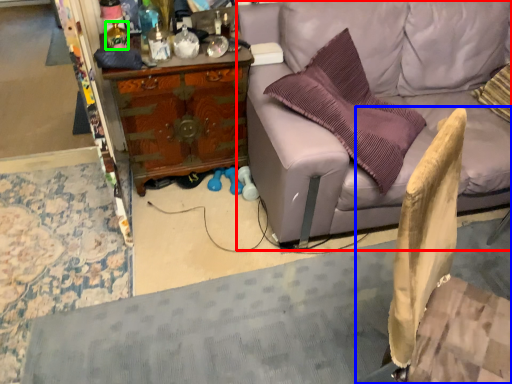
Question: Which is nearer to the studio couch (highlighted by a red box)? swivel chair (highlighted by a blue box) or bottle (highlighted by a green box).

Choices:
 (A) swivel chair
 (B) bottle

Answer: (A)